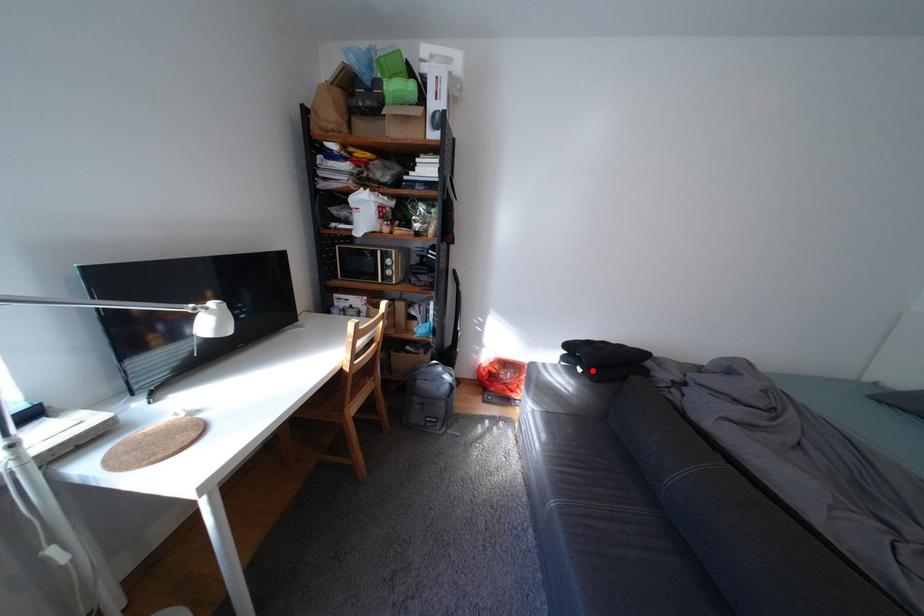
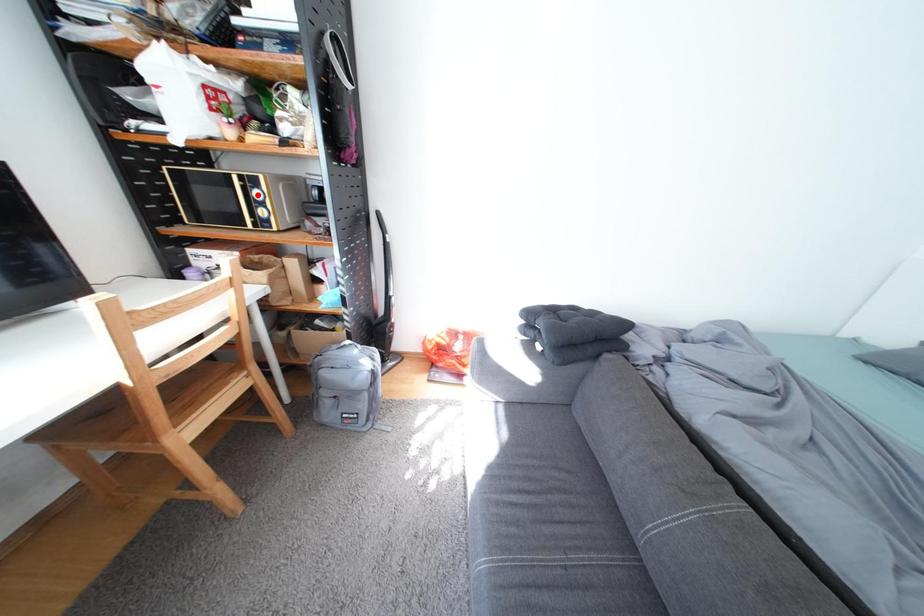
I am providing you with two images of the same scene from different viewpoints. A red point is marked on the first image and another point is marked on the second image. Is the red point in image1 aligned with the point shown in image2?

No